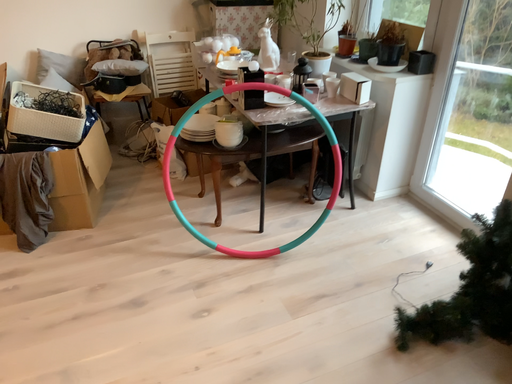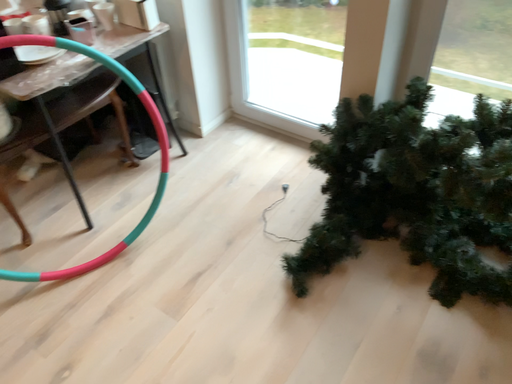
Question: Which way did the camera rotate in the video?

Choices:
 (A) rotated right
 (B) rotated left

Answer: (A)